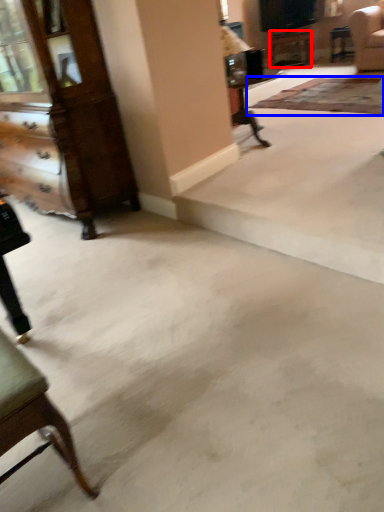
Question: Among these objects, which one is nearest to the camera, table (highlighted by a red box) or mat (highlighted by a blue box)?

Choices:
 (A) table
 (B) mat

Answer: (B)